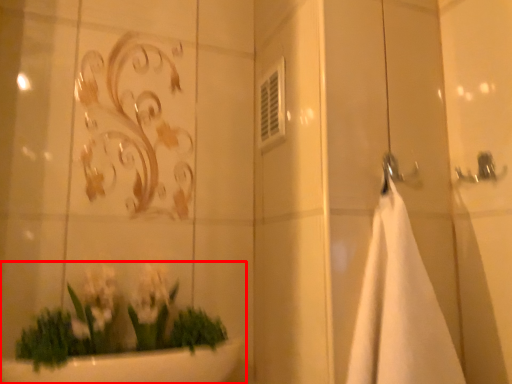
Question: Where is houseplant (annotated by the red box) located in relation to bath towel in the image?

Choices:
 (A) left
 (B) right

Answer: (A)